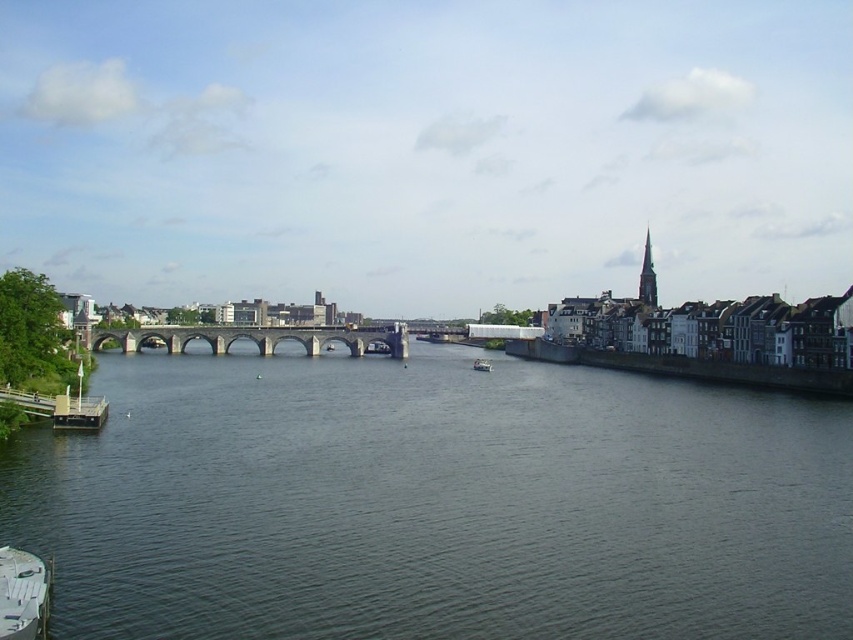
Between stone arch bridge at center and white plastic boat at center, which one appears on the left side from the viewer's perspective?

stone arch bridge at center is more to the left.

Is point (149, 337) farther from camera compared to point (482, 365)?

That is True.

The width and height of the screenshot is (853, 640). Identify the location of stone arch bridge at center. (257, 337).

Is point (575, 410) more distant than point (82, 397)?

Yes, it is.

Who is positioned more to the left, dark gray water at center or metallic gray boat at lower left?

metallic gray boat at lower left is more to the left.

You are a GUI agent. You are given a task and a screenshot of the screen. Output one action in this format:
    pyautogui.click(x=<x>, y=<y>)
    Task: Click on the dark gray water at center
    
    Given the screenshot: What is the action you would take?
    pyautogui.click(x=434, y=502)

Locate an element on the screen. Image resolution: width=853 pixels, height=640 pixels. dark gray water at center is located at coordinates (434, 502).

Between white plastic boat at lower left and metallic gray boat at lower left, which one appears on the right side from the viewer's perspective?

white plastic boat at lower left

Is white plastic boat at lower left in front of metallic gray boat at lower left?

Yes, white plastic boat at lower left is in front of metallic gray boat at lower left.

Who is more forward, (x=38, y=561) or (x=85, y=419)?

Point (x=38, y=561) is in front.

Image resolution: width=853 pixels, height=640 pixels. I want to click on white plastic boat at lower left, so click(x=22, y=595).